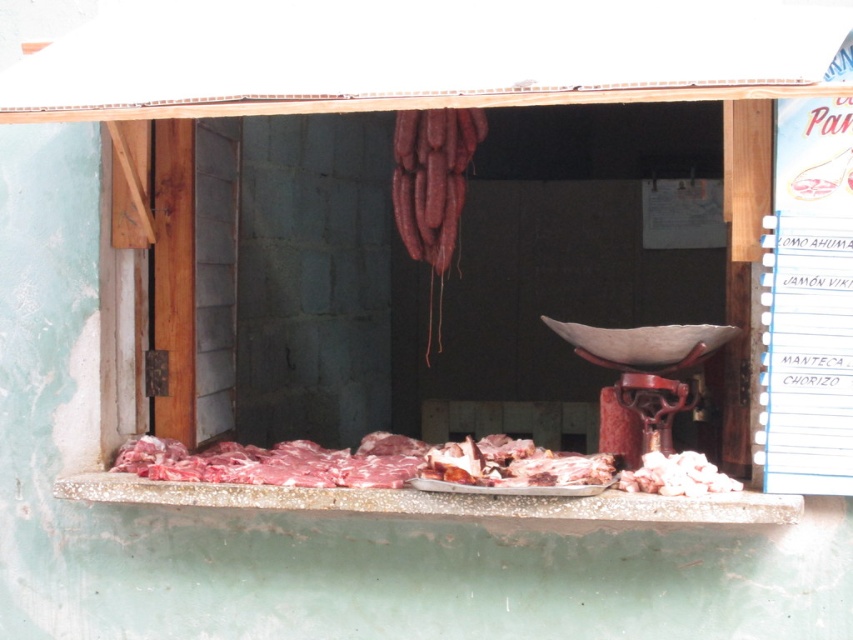
You are a customer at the meat stall and want to know which of the two points, point [225,488] or point [717,477], is closer to you. Can you determine this based on their positions?

Point [225,488] is closer to you than point [717,477] because it is further to the viewer.

You are a customer at the meat stall and want to buy the pink raw meat at lower right. Which direction should you look to find it relative to the smooth concrete meat at center?

The pink raw meat at lower right is above the smooth concrete meat at center, so you should look upward from the smooth concrete meat at center to find the pink raw meat at lower right.

You are a customer at the meat stall and want to buy the pink raw meat at lower right. However, you need to know if it is smaller than the smooth concrete meat at center. Can you confirm?

The smooth concrete meat at center has a larger size compared to pink raw meat at lower right, so yes, the pink raw meat at lower right is smaller than the smooth concrete meat at center.